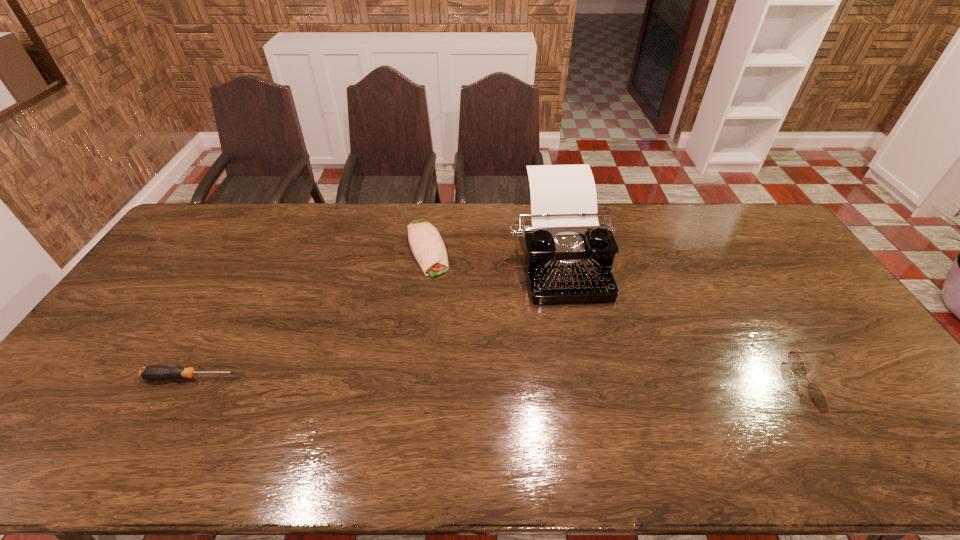
Where is `free region that satisfies the following two spatial constraints: 1. on the front side of the tallest object; 2. on the face of the sunglasses`? The width and height of the screenshot is (960, 540). free region that satisfies the following two spatial constraints: 1. on the front side of the tallest object; 2. on the face of the sunglasses is located at coordinates (584, 387).

You are a GUI agent. You are given a task and a screenshot of the screen. Output one action in this format:
    pyautogui.click(x=<x>, y=<y>)
    Task: Click on the vacant point that satisfies the following two spatial constraints: 1. on the front side of the sunglasses; 2. on the face of the second object from left to right
    This screenshot has width=960, height=540.
    Given the screenshot: What is the action you would take?
    pyautogui.click(x=408, y=387)